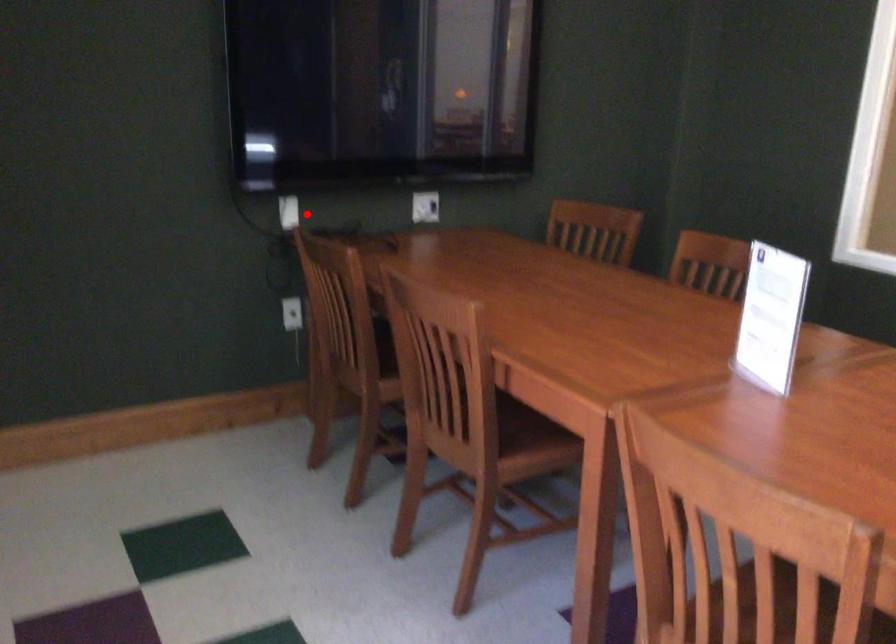
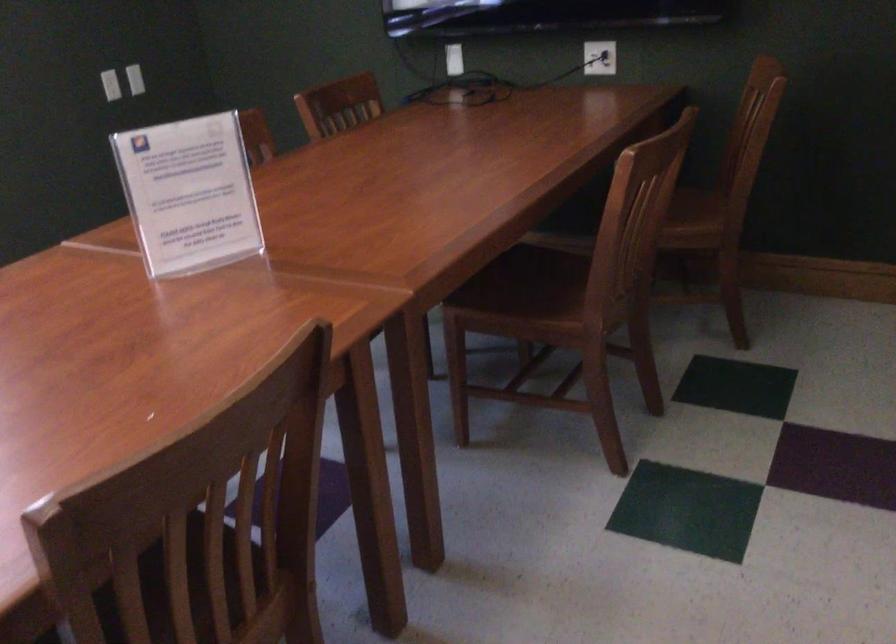
Locate, in the second image, the point that corresponds to the highlighted location in the first image.

(453, 59)